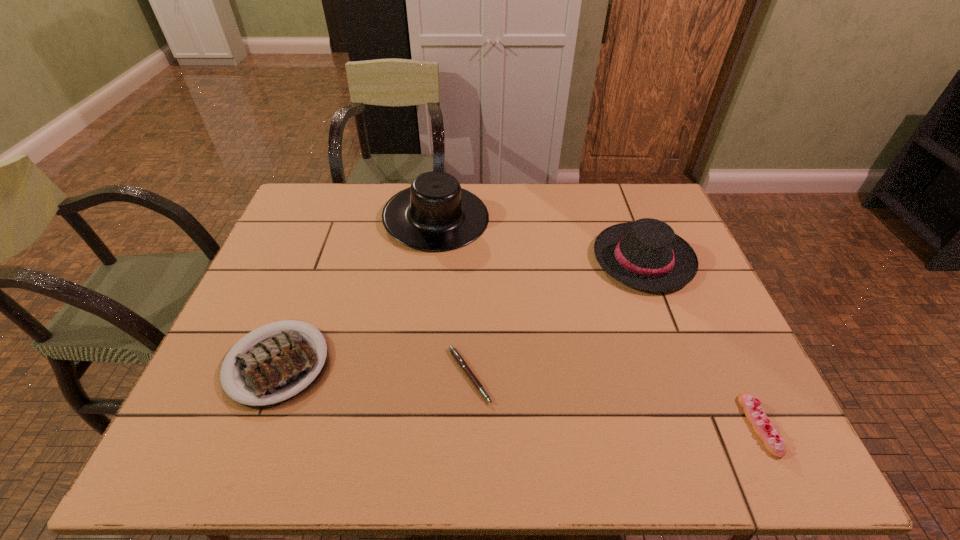
The width and height of the screenshot is (960, 540). Find the location of `free spot between the left dress hat and the eclair`. free spot between the left dress hat and the eclair is located at coordinates point(598,321).

Locate an element on the screen. The height and width of the screenshot is (540, 960). free point between the plate and the eclair is located at coordinates (518, 394).

Where is `vacant space that is in between the leftmost object and the eclair`? This screenshot has height=540, width=960. vacant space that is in between the leftmost object and the eclair is located at coordinates (518, 394).

Where is `free space between the fourth shortest object and the pen`? Image resolution: width=960 pixels, height=540 pixels. free space between the fourth shortest object and the pen is located at coordinates (556, 318).

This screenshot has width=960, height=540. I want to click on vacant area that lies between the eclair and the right dress hat, so click(x=702, y=342).

Choose which object is the fourth nearest neighbor to the eclair. Please provide its 2D coordinates. Your answer should be formatted as a tuple, i.e. [(x, y)], where the tuple contains the x and y coordinates of a point satisfying the conditions above.

[(278, 365)]

The image size is (960, 540). What are the coordinates of `object that stands as the fourth closest to the eclair` in the screenshot? It's located at (278, 365).

Locate an element on the screen. Image resolution: width=960 pixels, height=540 pixels. free space that satisfies the following two spatial constraints: 1. on the front side of the right dress hat; 2. at the nib of the pen is located at coordinates (688, 375).

Where is `vacant area in the image that satisfies the following two spatial constraints: 1. on the front side of the second tallest object; 2. on the right side of the taller dress hat`? vacant area in the image that satisfies the following two spatial constraints: 1. on the front side of the second tallest object; 2. on the right side of the taller dress hat is located at coordinates (431, 259).

Where is `vacant area in the image that satisfies the following two spatial constraints: 1. at the nib of the pen; 2. on the left side of the eclair`? vacant area in the image that satisfies the following two spatial constraints: 1. at the nib of the pen; 2. on the left side of the eclair is located at coordinates (468, 426).